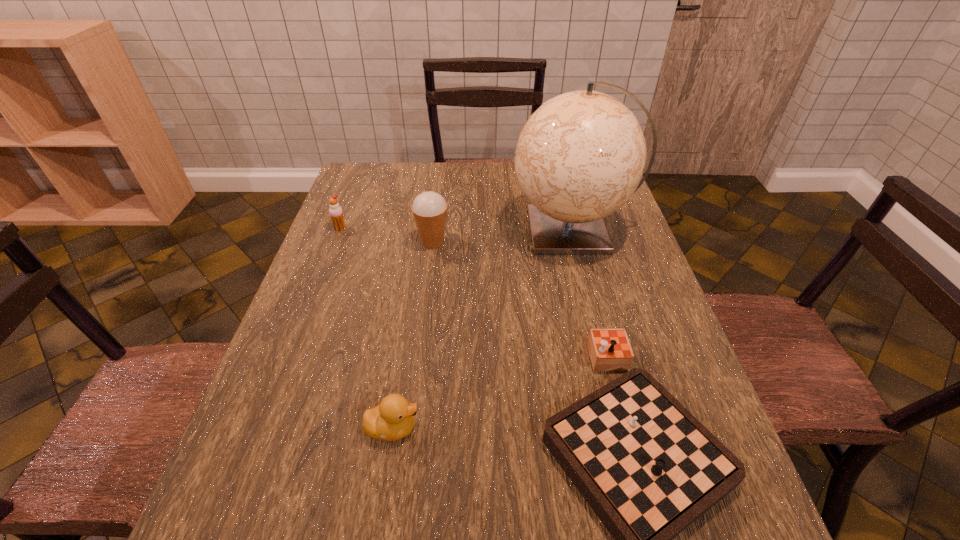
Locate an element on the screen. globe is located at coordinates (580, 156).

Identify the location of the nearer icecream. (429, 208).

Where is `the taller icecream`? The image size is (960, 540). the taller icecream is located at coordinates (429, 208).

Where is `the shorter icecream`? Image resolution: width=960 pixels, height=540 pixels. the shorter icecream is located at coordinates (336, 213).

At what (x,y) coordinates should I click in order to perform the action: click on the left icecream. Please return your answer as a coordinate pair (x, y). Image resolution: width=960 pixels, height=540 pixels. Looking at the image, I should click on (336, 213).

Where is `duckling`? Image resolution: width=960 pixels, height=540 pixels. duckling is located at coordinates (393, 419).

What are the coordinates of `blank space located 0.330m on the surface of the globe showing Europe and Africa` in the screenshot? It's located at (397, 231).

You are a GUI agent. You are given a task and a screenshot of the screen. Output one action in this format:
    pyautogui.click(x=<x>, y=<y>)
    Task: Click on the vacant space situated 0.200m on the surface of the globe showing Europe and Africa
    
    Given the screenshot: What is the action you would take?
    pyautogui.click(x=443, y=231)

Where is `vacant area situated 0.190m on the surface of the globe showing Europe and Africa`? The width and height of the screenshot is (960, 540). vacant area situated 0.190m on the surface of the globe showing Europe and Africa is located at coordinates (445, 231).

Where is `free location located 0.360m on the right of the fourth shortest object`? free location located 0.360m on the right of the fourth shortest object is located at coordinates (576, 242).